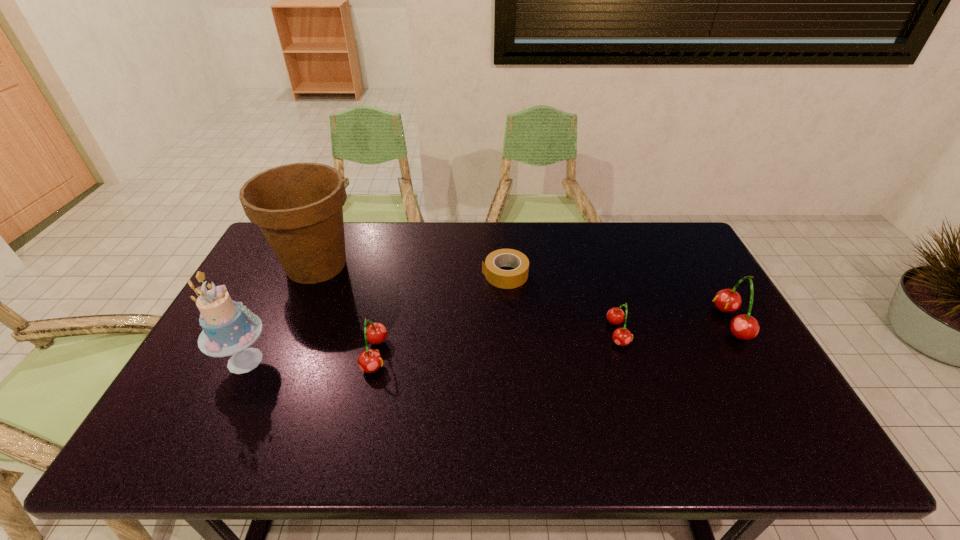
Locate an element on the screen. Image resolution: width=960 pixels, height=540 pixels. the leftmost cherry is located at coordinates (370, 360).

Identify the location of the second tallest cherry. (370, 360).

Where is `the second shortest object`? The image size is (960, 540). the second shortest object is located at coordinates (621, 336).

Image resolution: width=960 pixels, height=540 pixels. Identify the location of the second object from right to left. (621, 336).

This screenshot has width=960, height=540. Identify the location of the rightmost object. (745, 327).

What are the coordinates of `flowerpot` in the screenshot? It's located at (299, 207).

Locate an element on the screen. This screenshot has height=540, width=960. the fourth object from left to right is located at coordinates (506, 279).

Locate an element on the screen. This screenshot has height=540, width=960. the shortest object is located at coordinates (506, 279).

You are a GUI agent. You are given a task and a screenshot of the screen. Output one action in this format:
    pyautogui.click(x=<x>, y=<y>)
    Task: Click on the cake
    
    Given the screenshot: What is the action you would take?
    pyautogui.click(x=229, y=328)

Image resolution: width=960 pixels, height=540 pixels. Identify the location of free point located with stems pointing upwards on the fourth tallest object. (512, 355).